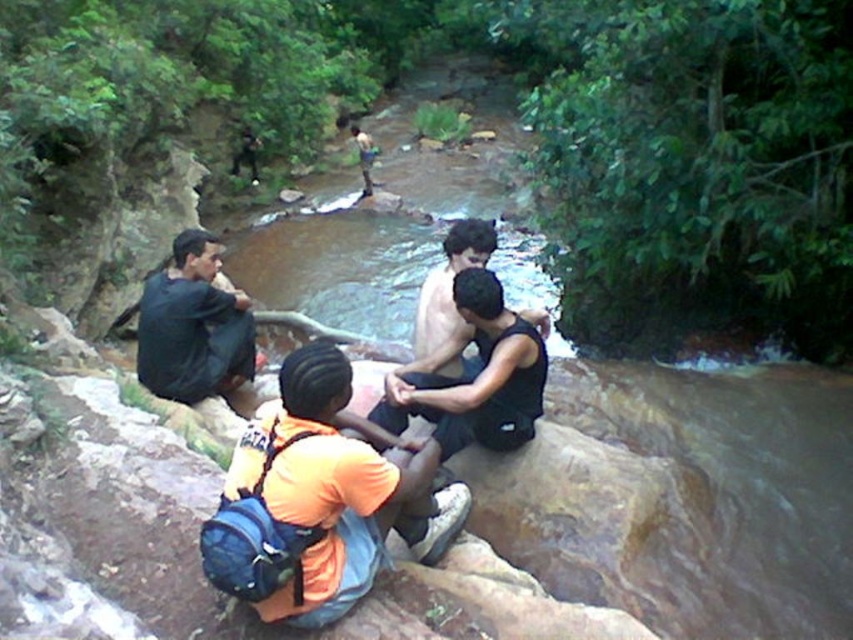
Who is higher up, orange fabric backpack at center or shiny black tank top at center?

shiny black tank top at center is above.

What do you see at coordinates (321, 499) in the screenshot? I see `orange fabric backpack at center` at bounding box center [321, 499].

You are a GUI agent. You are given a task and a screenshot of the screen. Output one action in this format:
    pyautogui.click(x=<x>, y=<y>)
    Task: Click on the orange fabric backpack at center
    The height and width of the screenshot is (640, 853).
    Given the screenshot: What is the action you would take?
    pyautogui.click(x=321, y=499)

Can you confirm if dark blue fabric shirt at left is positioned below shiny black tank top at center?

Correct, dark blue fabric shirt at left is located below shiny black tank top at center.

The height and width of the screenshot is (640, 853). In order to click on dark blue fabric shirt at left in this screenshot , I will do `click(193, 326)`.

Who is positioned more to the left, black matte shorts at center or shiny black tank top at center?

Positioned to the left is shiny black tank top at center.

Which is in front, point (532, 420) or point (460, 259)?

Point (460, 259) is more forward.

Identify the location of black matte shorts at center. (473, 376).